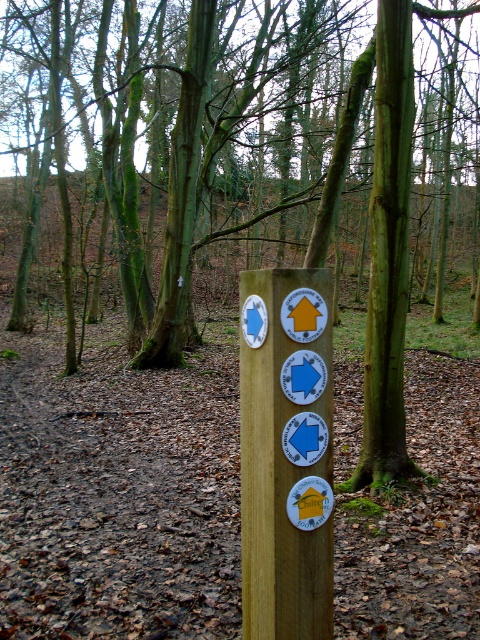
In the scene shown: You are a hiker trying to read the trail directions on the wooden signpost at center. However, the green mossy tree at center is blocking your view. Can you move around the tree to get a better look at the signpost?

The green mossy tree at center is larger in size than wooden signpost at center, so it might block your view. To get a better look at the wooden signpost at center, you should move around the tree to find an unobstructed path where the tree is no longer in front of the signpost.

You are a hiker trying to read the trail markers on the wooden signpost at center. A green mossy tree at center is blocking your view. Can you move the tree to see the signpost better?

The green mossy tree at center is above the wooden signpost at center, so moving the tree might help you see the signpost better.